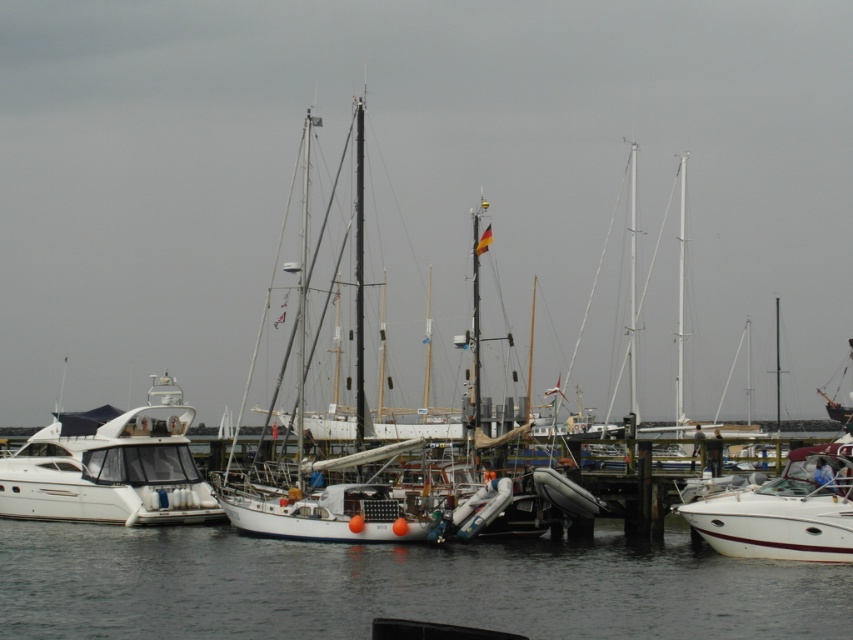
You are standing at point (53, 420) and want to reach the German flag on the sailboat. Given that your walking speed is 3 feet per second, how many seconds will it take you to walk directly to the German flag?

The distance between point (53, 420) and the German flag on the sailboat is 254.69 feet. At a speed of 3 feet per second, it would take approximately 84.896 seconds to reach the German flag on the sailboat.